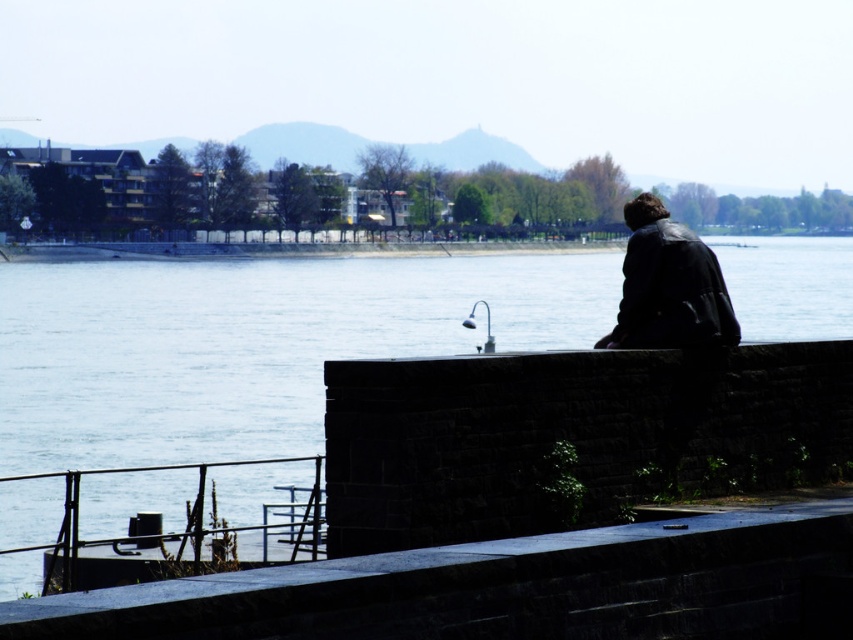
You are standing at the edge of the riverside scene and want to place a small potted plant between the blue water at center and the smooth stone ledge at lower center. Based on their positions, where should you place the potted plant?

The blue water at center is to the left of the smooth stone ledge at lower center, so you should place the potted plant to the right of the blue water at center and to the left of the smooth stone ledge at lower center.

You are a photographer standing at the riverside. You want to capture a photo of the blue water at center and the leather jacket at right. Based on their positions, which object should appear closer to the camera in your photo?

The blue water at center appears closer to the camera because it is positioned in front of the leather jacket at right.

You are standing at the point marked by the coordinates point [506,588] in the riverside scene. What object are you standing on?

You are standing on the smooth stone ledge at lower center, as the coordinates point [506,588] indicate this specific location.